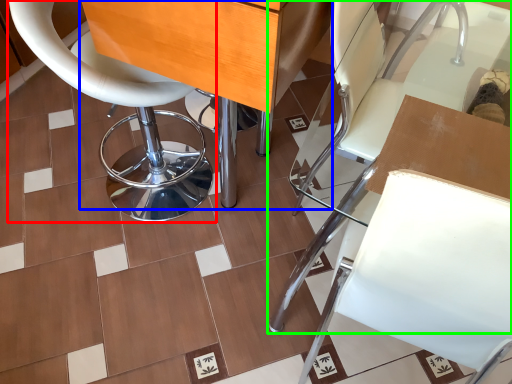
Question: Estimate the real-world distances between objects in this image. Which object is farther from chair (highlighted by a red box), table (highlighted by a blue box) or chair (highlighted by a green box)?

Choices:
 (A) table
 (B) chair

Answer: (B)